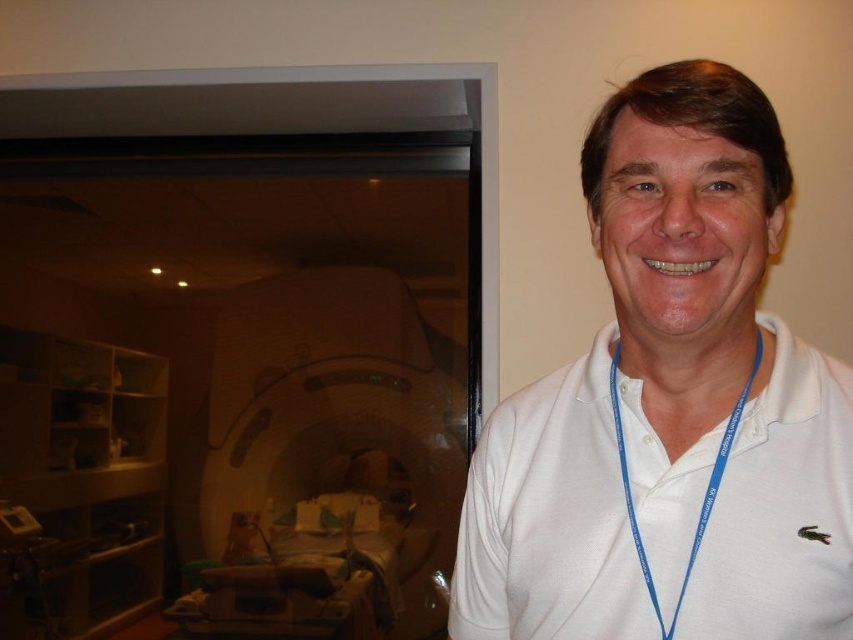
Question: Can you confirm if blue fabric lanyard at center is smaller than white smooth neck at center?

Choices:
 (A) no
 (B) yes

Answer: (A)

Question: Among these points, which one is farthest from the camera?

Choices:
 (A) (651, 596)
 (B) (675, 390)
 (C) (637, 86)

Answer: (B)

Question: Can you confirm if blue fabric lanyard at center is thinner than white smooth neck at center?

Choices:
 (A) no
 (B) yes

Answer: (B)

Question: Estimate the real-world distances between objects in this image. Which object is farther from the white smooth neck at center?

Choices:
 (A) blue fabric lanyard at center
 (B) white cotton polo shirt at center

Answer: (B)

Question: Which object is closer to the camera taking this photo?

Choices:
 (A) white smooth neck at center
 (B) white cotton polo shirt at center

Answer: (B)

Question: Can you confirm if white cotton polo shirt at center is positioned to the right of white smooth neck at center?

Choices:
 (A) yes
 (B) no

Answer: (B)